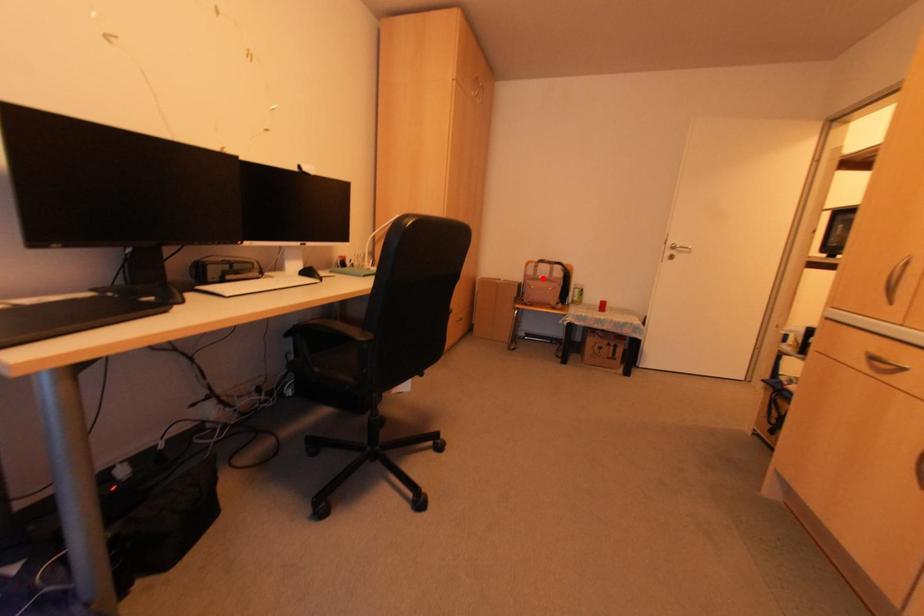
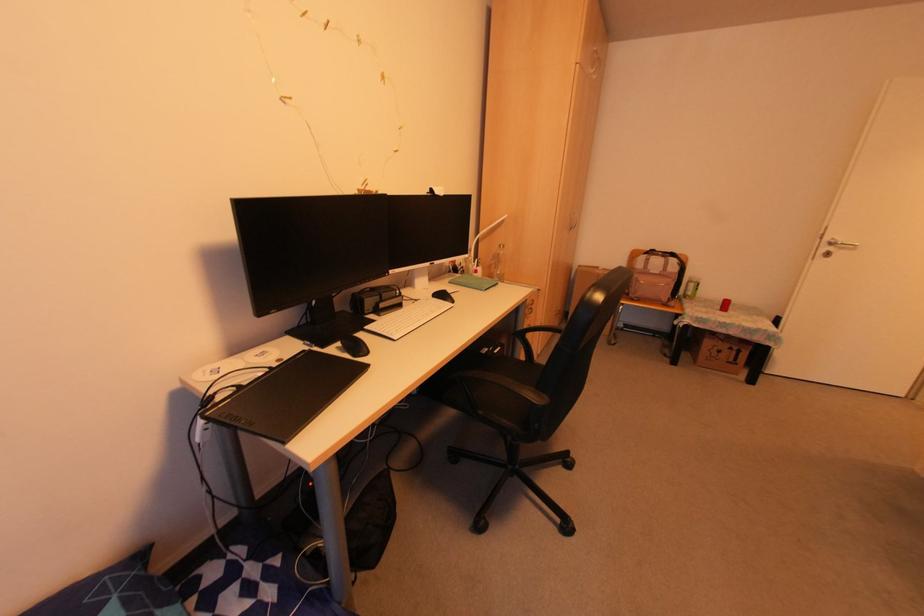
In the second image, find the point that corresponds to the highlighted location in the first image.

(655, 273)